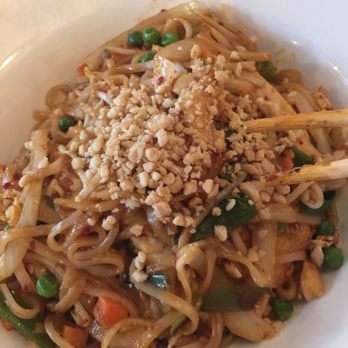
Where is `bowl`? The height and width of the screenshot is (348, 348). bowl is located at coordinates (45, 67).